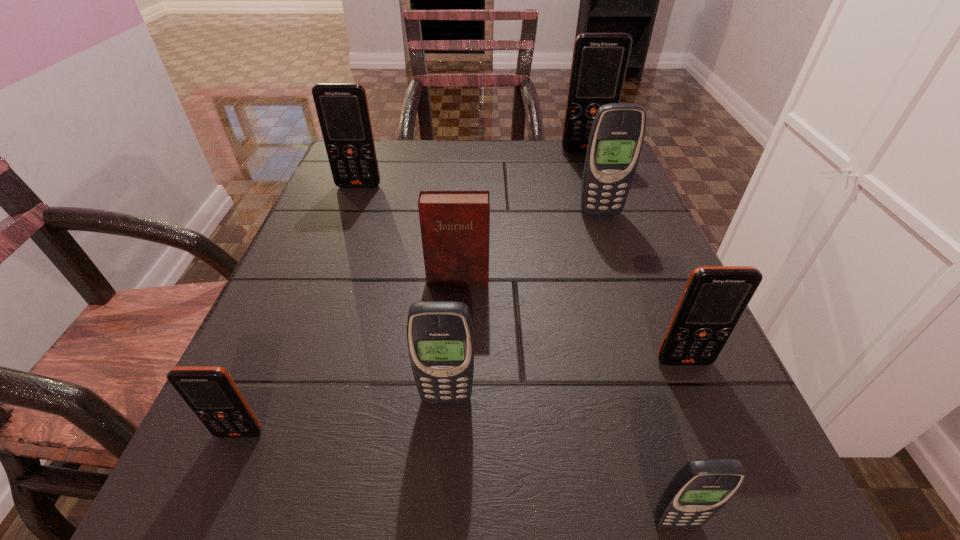
The height and width of the screenshot is (540, 960). In order to click on vacant area between the third nearest object and the farthest gray cellular telephone in this screenshot , I will do `click(523, 306)`.

Identify the location of object that is the third closest to the nearest object. The width and height of the screenshot is (960, 540). (455, 225).

Identify the location of the closest object to the nearest object. (715, 297).

Identify which cellular telephone is the fifth closest to the third nearest cellular telephone. Please provide its 2D coordinates. Your answer should be formatted as a tuple, i.e. [(x, y)], where the tuple contains the x and y coordinates of a point satisfying the conditions above.

[(342, 108)]

Identify which cellular telephone is the fifth closest to the smallest orange cellular telephone. Please provide its 2D coordinates. Your answer should be formatted as a tuple, i.e. [(x, y)], where the tuple contains the x and y coordinates of a point satisfying the conditions above.

[(617, 133)]

At what (x,y) coordinates should I click in order to perform the action: click on the third closest orange cellular telephone to the fourth nearest object. Please return your answer as a coordinate pair (x, y). Looking at the image, I should click on (342, 108).

Find the location of a particular element. orange cellular telephone that is the nearest to the fifth nearest cellular telephone is located at coordinates (599, 63).

Image resolution: width=960 pixels, height=540 pixels. I want to click on gray cellular telephone identified as the closest to the nearest gray cellular telephone, so click(440, 336).

Locate which gray cellular telephone is the third closest to the second smallest orange cellular telephone. Please provide its 2D coordinates. Your answer should be formatted as a tuple, i.e. [(x, y)], where the tuple contains the x and y coordinates of a point satisfying the conditions above.

[(617, 133)]